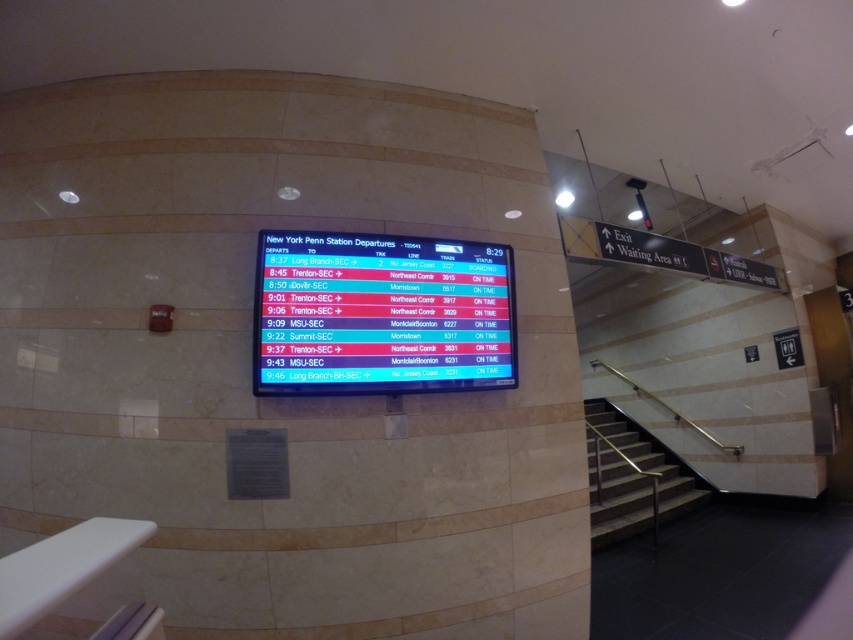
You are a traveler holding a 12 inch wide map and want to check the departure board. Can you place the map next to the backlit lcd display at center without overlapping the metallic silver handrail at lower right?

The backlit lcd display at center is narrower than the metallic silver handrail at lower right. Since the map is 12 inches wide, it can be placed next to the backlit lcd display at center as long as there is enough space between them and the handrail. However, the exact feasibility depends on the available space between the display and the handrail, which isn

You are standing in the train station looking at the departure board. There are two points marked on the board at coordinates point (311, 348) and point (630, 442). Which point is closer to you?

Point (311, 348) is closer to the viewer than point (630, 442).